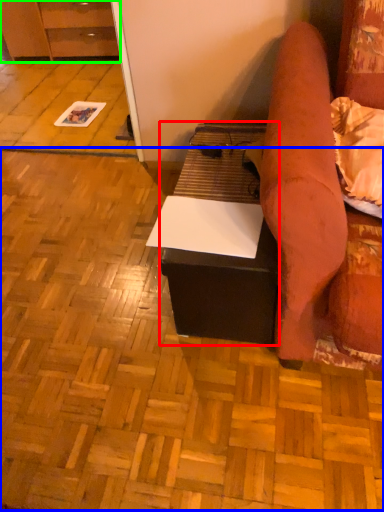
Question: Considering the real-world distances, which object is closest to table (highlighted by a red box)? plywood (highlighted by a blue box) or cabinetry (highlighted by a green box).

Choices:
 (A) plywood
 (B) cabinetry

Answer: (A)